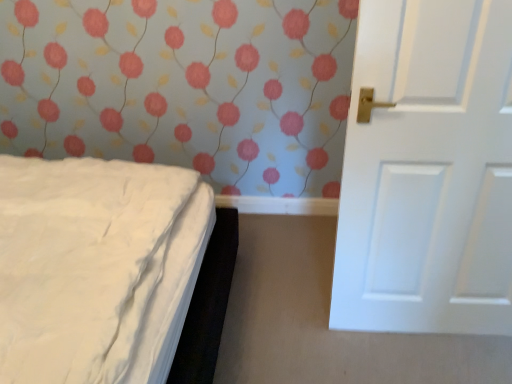
Find the location of a particular element. The width and height of the screenshot is (512, 384). vacant space situated on the left part of white matte door at right is located at coordinates (307, 324).